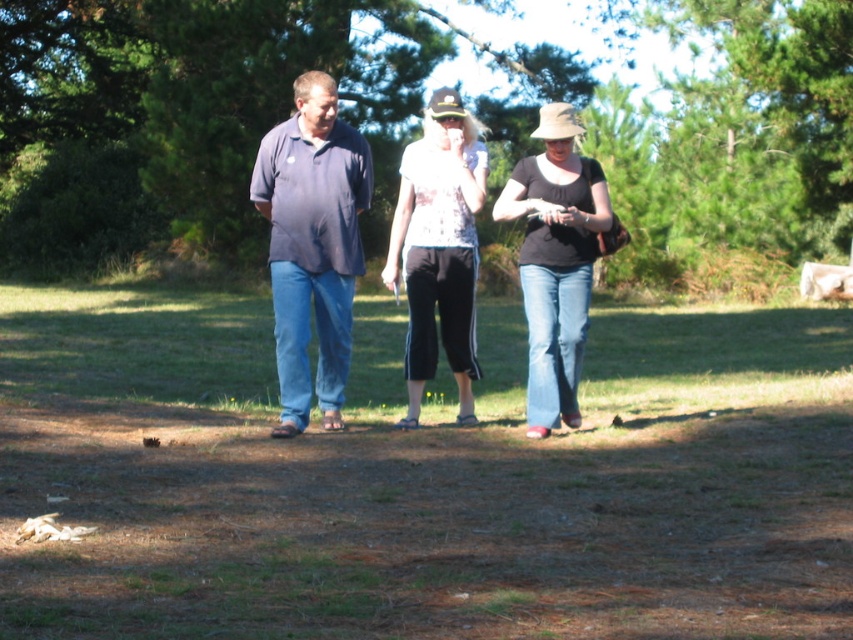
Is blue jeans at center taller than white printed blouse at center?

Indeed, blue jeans at center has a greater height compared to white printed blouse at center.

Can you confirm if blue jeans at center is positioned below white printed blouse at center?

Correct, blue jeans at center is located below white printed blouse at center.

In the scene shown: Who is more distant from viewer, (10, 444) or (444, 102)?

Point (444, 102)

Where is `blue jeans at center`? This screenshot has width=853, height=640. blue jeans at center is located at coordinates (422, 477).

The image size is (853, 640). Find the location of `blue jeans at center`. blue jeans at center is located at coordinates [x=422, y=477].

Can you confirm if blue jeans at center is smaller than black matte shirt at center?

Actually, blue jeans at center might be larger than black matte shirt at center.

Identify the location of blue jeans at center. This screenshot has height=640, width=853. (422, 477).

Does blue jeans at center have a lesser width compared to matte blue shirt at center?

Incorrect, blue jeans at center's width is not less than matte blue shirt at center's.

Which is more to the right, blue jeans at center or matte blue shirt at center?

From the viewer's perspective, matte blue shirt at center appears more on the right side.

Does point (844, 588) lie in front of point (454, 150)?

Yes, it is in front of point (454, 150).

Where is `blue jeans at center`? blue jeans at center is located at coordinates (422, 477).